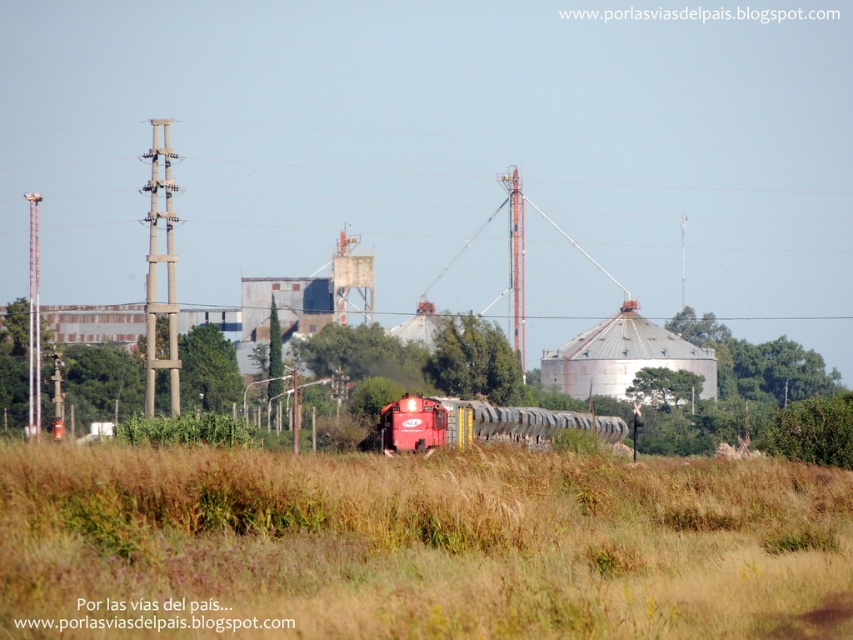
Question: Among these objects, which one is farthest from the camera?

Choices:
 (A) matte red train at center
 (B) brown grassy field at center

Answer: (A)

Question: Is brown grassy field at center bigger than matte red train at center?

Choices:
 (A) no
 (B) yes

Answer: (A)

Question: Which object is farther from the camera taking this photo?

Choices:
 (A) matte red train at center
 (B) brown grassy field at center

Answer: (A)

Question: Is brown grassy field at center wider than matte red train at center?

Choices:
 (A) no
 (B) yes

Answer: (B)

Question: Does brown grassy field at center appear on the right side of matte red train at center?

Choices:
 (A) yes
 (B) no

Answer: (A)